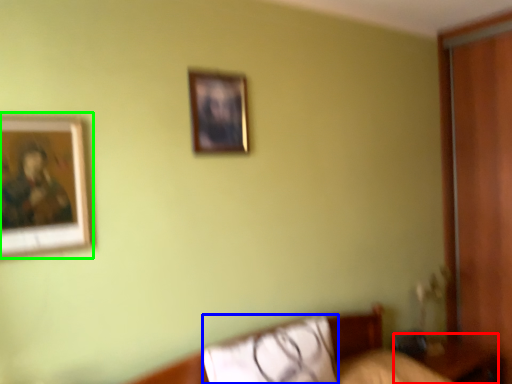
Question: Estimate the real-world distances between objects in this image. Which object is closer to table (highlighted by a red box), pillow (highlighted by a blue box) or picture frame (highlighted by a green box)?

Choices:
 (A) pillow
 (B) picture frame

Answer: (A)